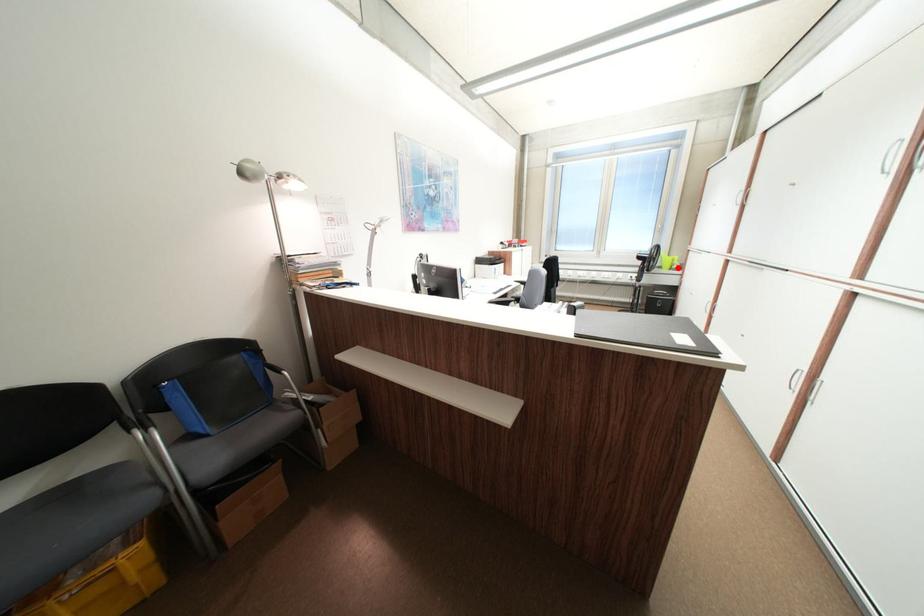
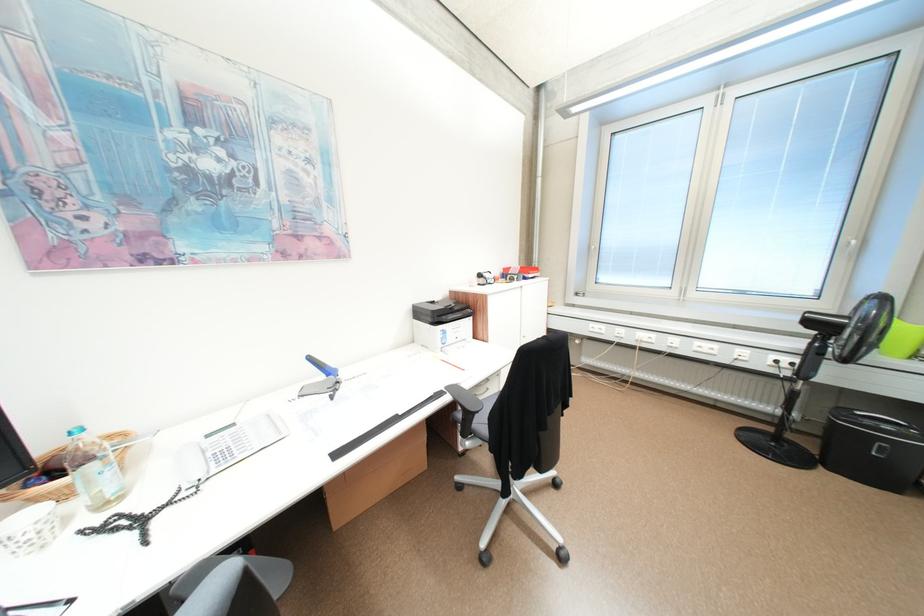
Locate, in the second image, the point that corresponds to the highlighted location in the first image.

(917, 352)